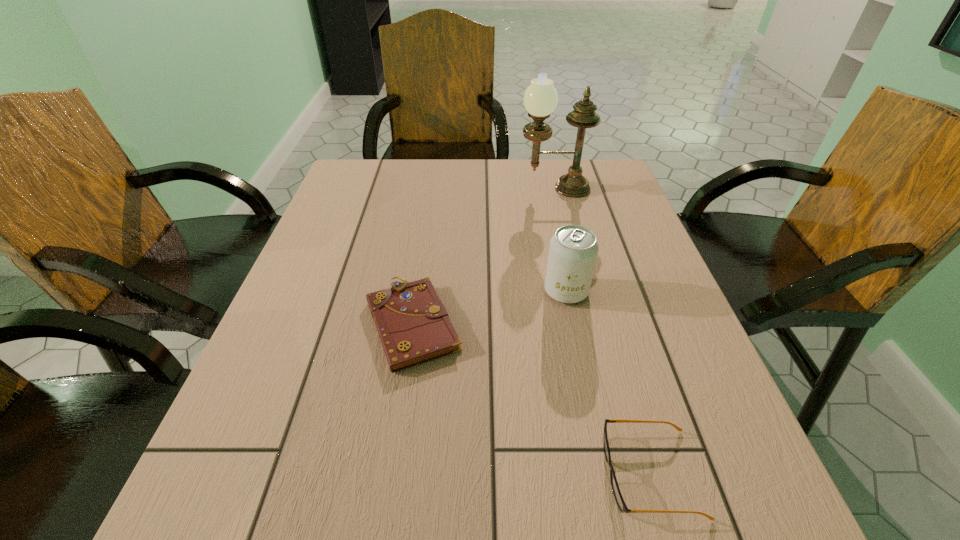
You are a GUI agent. You are given a task and a screenshot of the screen. Output one action in this format:
    pyautogui.click(x=<x>, y=<y>)
    Task: Click on the tallest object
    This screenshot has width=960, height=540.
    Given the screenshot: What is the action you would take?
    pyautogui.click(x=540, y=99)

Locate an element on the screen. Image resolution: width=960 pixels, height=540 pixels. the farthest object is located at coordinates (540, 99).

Identify the location of soda can. The width and height of the screenshot is (960, 540). (573, 250).

Locate an element on the screen. The height and width of the screenshot is (540, 960). the nearest object is located at coordinates (619, 499).

You are a GUI agent. You are given a task and a screenshot of the screen. Output one action in this format:
    pyautogui.click(x=<x>, y=<y>)
    Task: Click on the shortest object
    This screenshot has height=540, width=960.
    Given the screenshot: What is the action you would take?
    (413, 325)

The image size is (960, 540). Find the location of `the leftmost object`. the leftmost object is located at coordinates (413, 325).

The height and width of the screenshot is (540, 960). I want to click on vacant space located on the front of the farthest object, so click(x=564, y=228).

The height and width of the screenshot is (540, 960). Find the location of `vacant region located 0.070m on the right of the third shortest object`. vacant region located 0.070m on the right of the third shortest object is located at coordinates (621, 292).

Where is `free space located on the front-facing side of the spectacles`? free space located on the front-facing side of the spectacles is located at coordinates (495, 473).

You are a GUI agent. You are given a task and a screenshot of the screen. Output one action in this format:
    pyautogui.click(x=<x>, y=<y>)
    Task: Click on the vacant point located on the front-facing side of the spectacles
    Image resolution: width=960 pixels, height=540 pixels.
    Given the screenshot: What is the action you would take?
    pyautogui.click(x=550, y=473)